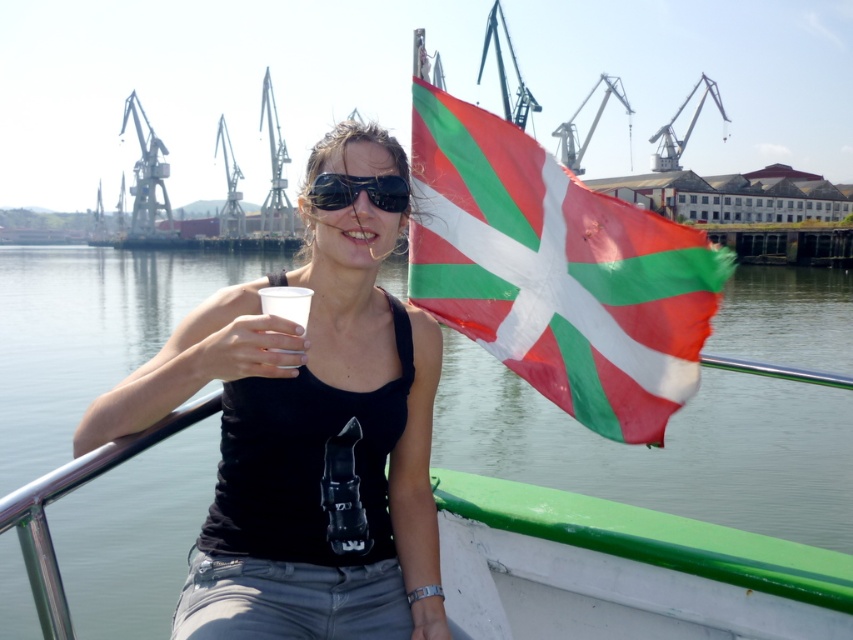
Who is shorter, black matte tank top at center or sunglasses at center?

With less height is sunglasses at center.

Is black matte tank top at center closer to the viewer compared to sunglasses at center?

Yes, it is in front of sunglasses at center.

Which is in front, point (418, 317) or point (323, 209)?

Point (323, 209) is in front.

Locate an element on the screen. Image resolution: width=853 pixels, height=640 pixels. black matte tank top at center is located at coordinates (305, 444).

Can you confirm if transparent plastic cup at upper center is thinner than red-green fabric flag at center?

In fact, transparent plastic cup at upper center might be wider than red-green fabric flag at center.

Locate an element on the screen. transparent plastic cup at upper center is located at coordinates (666, 448).

The image size is (853, 640). Identify the location of transparent plastic cup at upper center. click(666, 448).

You are a GUI agent. You are given a task and a screenshot of the screen. Output one action in this format:
    pyautogui.click(x=<x>, y=<y>)
    Task: Click on the sunglasses at center
    
    Given the screenshot: What is the action you would take?
    pyautogui.click(x=358, y=192)

Find the location of a particular element. sunglasses at center is located at coordinates (x=358, y=192).